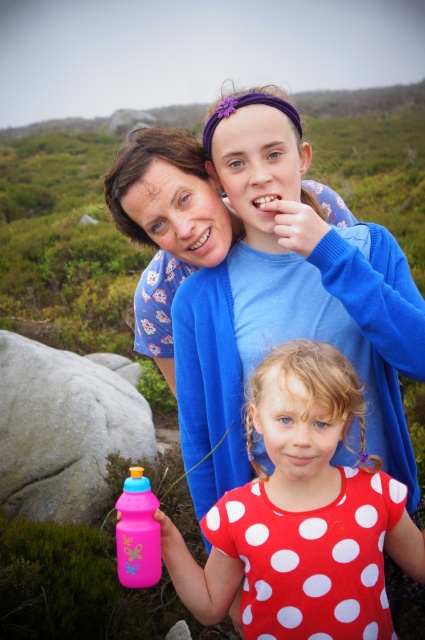
Who is higher up, pink plastic water bottle at center or gray rough rock at lower left?

pink plastic water bottle at center is above.

The height and width of the screenshot is (640, 425). Find the location of `pink plastic water bottle at center`. pink plastic water bottle at center is located at coordinates (300, 515).

Does point (275, 508) come farther from viewer compared to point (36, 412)?

No, (275, 508) is closer to viewer.

Find the location of `pink plastic water bottle at center`. pink plastic water bottle at center is located at coordinates (300, 515).

Is pink plastic water bottle at center wider than pink plastic bottle at lower left?

Correct, the width of pink plastic water bottle at center exceeds that of pink plastic bottle at lower left.

Can you confirm if pink plastic water bottle at center is taller than pink plastic bottle at lower left?

Indeed, pink plastic water bottle at center has a greater height compared to pink plastic bottle at lower left.

Is point (311, 536) more distant than point (132, 547)?

Yes, point (311, 536) is behind point (132, 547).

You are a GUI agent. You are given a task and a screenshot of the screen. Output one action in this format:
    pyautogui.click(x=<x>, y=<y>)
    Task: Click on the pink plastic water bottle at center
    This screenshot has width=425, height=640.
    Given the screenshot: What is the action you would take?
    pyautogui.click(x=300, y=515)

Does gray rough rock at lower left have a greater width compared to pink plastic bottle at lower left?

Indeed, gray rough rock at lower left has a greater width compared to pink plastic bottle at lower left.

Where is `gray rough rock at lower left`? This screenshot has width=425, height=640. gray rough rock at lower left is located at coordinates (64, 429).